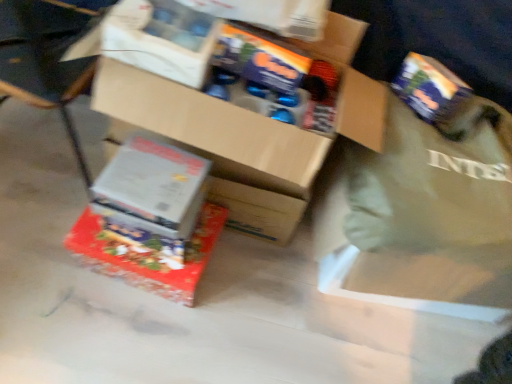
Question: Is cardboard box at center, marked as the 3th box in a bottom-to-top arrangement, bigger than shiny metallic box at center, placed as the 3th box when sorted from top to bottom?

Choices:
 (A) yes
 (B) no

Answer: (A)

Question: Considering the relative positions of cardboard box at center, the first box positioned from the top, and shiny metallic box at center, placed as the 3th box when sorted from top to bottom, in the image provided, is cardboard box at center, the first box positioned from the top, behind shiny metallic box at center, placed as the 3th box when sorted from top to bottom,?

Choices:
 (A) no
 (B) yes

Answer: (A)

Question: Does cardboard box at center, marked as the 3th box in a bottom-to-top arrangement, have a smaller size compared to shiny metallic box at center, positioned as the first box in bottom-to-top order?

Choices:
 (A) yes
 (B) no

Answer: (B)

Question: Is cardboard box at center, marked as the 3th box in a bottom-to-top arrangement, looking in the opposite direction of shiny metallic box at center, placed as the 3th box when sorted from top to bottom?

Choices:
 (A) no
 (B) yes

Answer: (A)

Question: Is cardboard box at center, marked as the 3th box in a bottom-to-top arrangement, with shiny metallic box at center, positioned as the first box in bottom-to-top order?

Choices:
 (A) yes
 (B) no

Answer: (B)

Question: Is cardboard box at center, the first box positioned from the top, taller than shiny metallic box at center, positioned as the first box in bottom-to-top order?

Choices:
 (A) no
 (B) yes

Answer: (B)

Question: Is the depth of green fabric tote bag at right greater than that of white cardboard box at lower left, placed as the 2th box when sorted from bottom to top?

Choices:
 (A) no
 (B) yes

Answer: (A)

Question: Is green fabric tote bag at right closer to the viewer compared to white cardboard box at lower left, placed as the 2th box when sorted from bottom to top?

Choices:
 (A) no
 (B) yes

Answer: (B)

Question: Is green fabric tote bag at right taller than white cardboard box at lower left, placed as the 2th box when sorted from bottom to top?

Choices:
 (A) no
 (B) yes

Answer: (B)

Question: From a real-world perspective, does green fabric tote bag at right sit lower than white cardboard box at lower left, marked as the 2th box in a top-to-bottom arrangement?

Choices:
 (A) no
 (B) yes

Answer: (A)

Question: Is green fabric tote bag at right next to white cardboard box at lower left, marked as the 2th box in a top-to-bottom arrangement, and touching it?

Choices:
 (A) yes
 (B) no

Answer: (B)

Question: Considering the relative sizes of green fabric tote bag at right and white cardboard box at lower left, marked as the 2th box in a top-to-bottom arrangement, in the image provided, is green fabric tote bag at right shorter than white cardboard box at lower left, marked as the 2th box in a top-to-bottom arrangement,?

Choices:
 (A) no
 (B) yes

Answer: (A)

Question: Is the surface of wooden chair at lower left in direct contact with white cardboard box at lower left, placed as the 2th box when sorted from bottom to top?

Choices:
 (A) yes
 (B) no

Answer: (B)